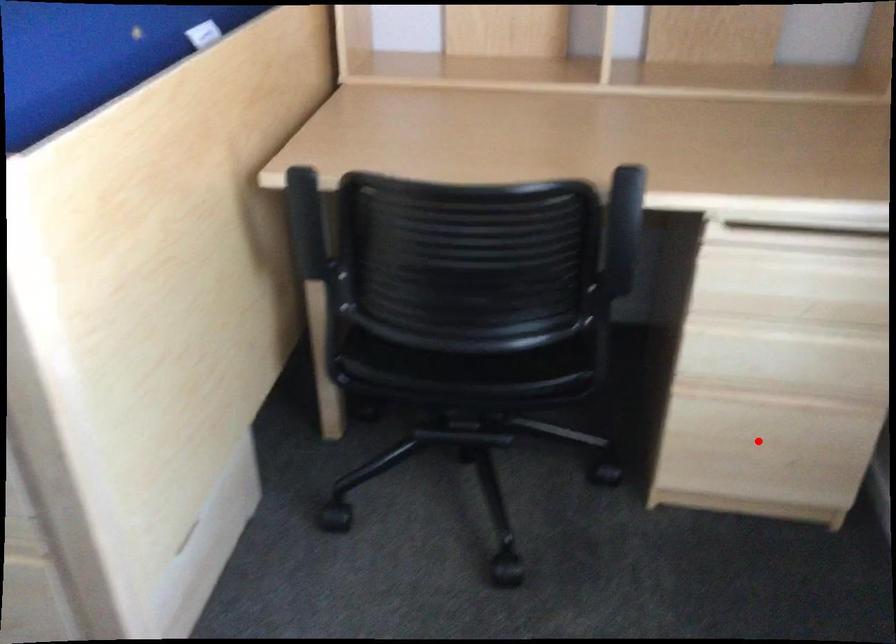
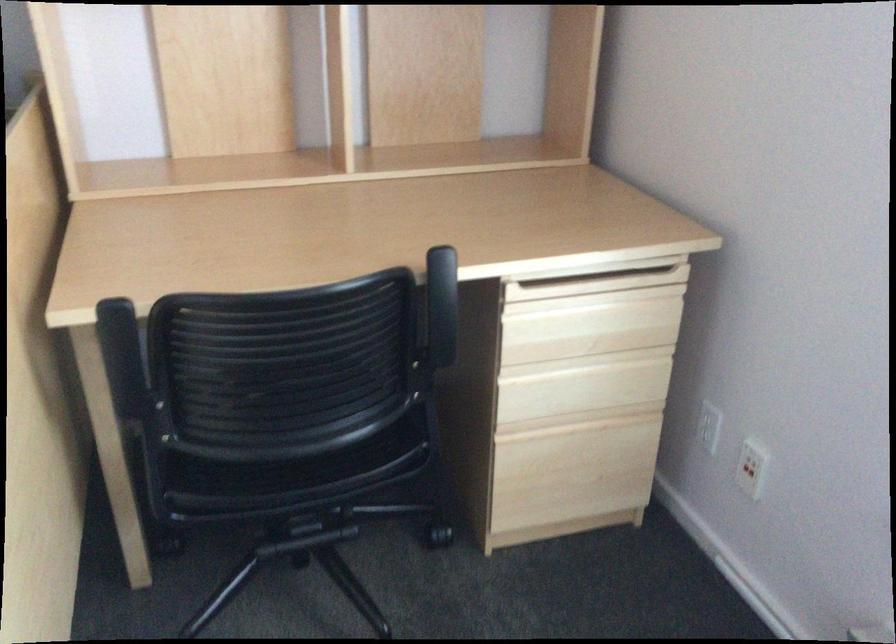
Question: A red point is marked in image1. In image2, is the corresponding 3D point closer to the camera or farther? Reply with the corresponding letter.

Choices:
 (A) The corresponding 3D point is closer.
 (B) The corresponding 3D point is farther.

Answer: (B)